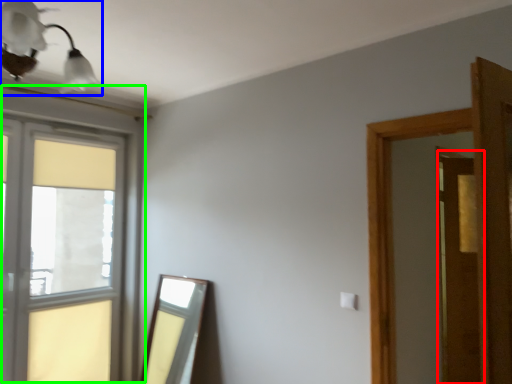
Question: Based on their relative distances, which object is farther from screen door (highlighted by a red box)? Choose from light fixture (highlighted by a blue box) and window (highlighted by a green box).

Choices:
 (A) light fixture
 (B) window

Answer: (A)